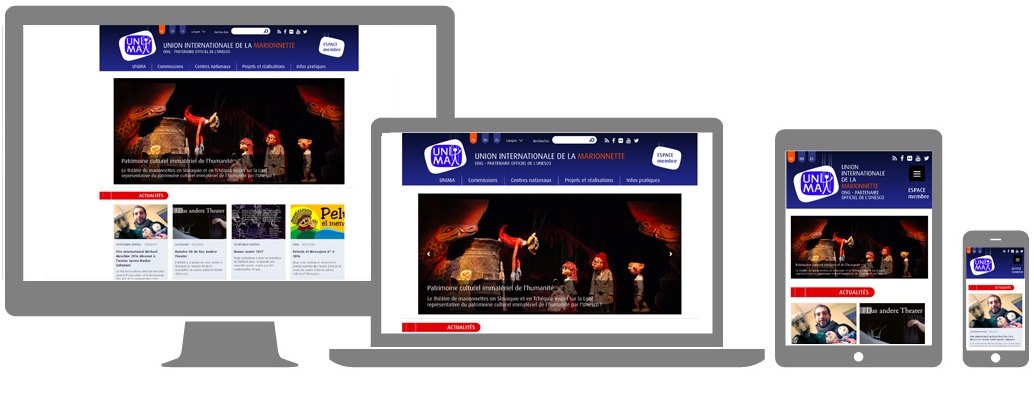
The width and height of the screenshot is (1034, 403). In order to click on monitor in this screenshot , I will do `click(60, 220)`.